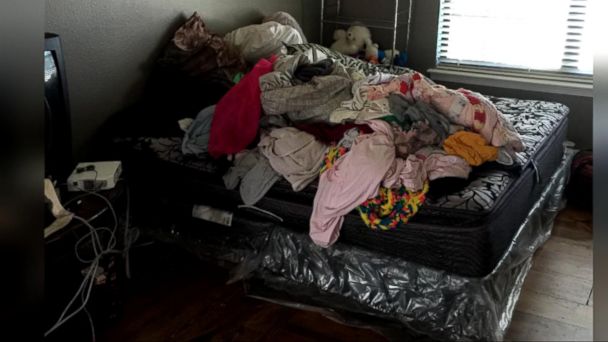
Locate an element on the screen. Image resolution: width=608 pixels, height=342 pixels. dark gray wall is located at coordinates (142, 16).